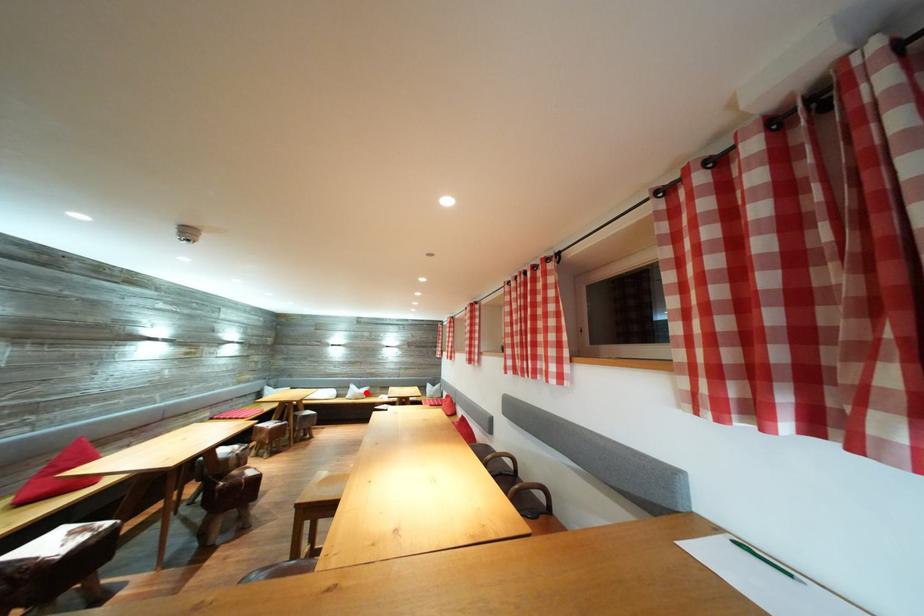
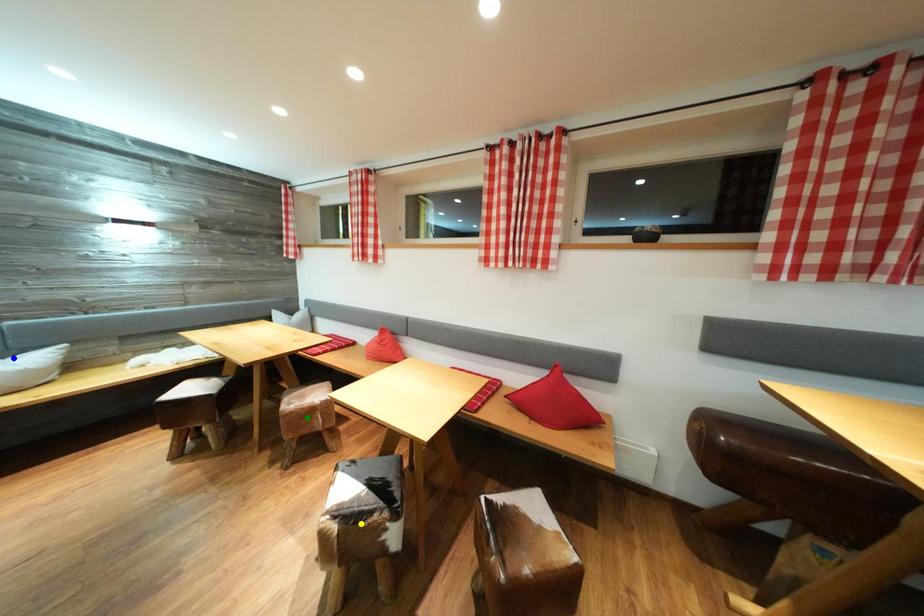
Question: I am providing you with two images of the same scene from different viewpoints. A red point is marked on the first image. You are given multiple points on the second image. Can you choose the point in image 2 that corresponds to the point in image 1?

Choices:
 (A) blue point
 (B) yellow point
 (C) green point

Answer: (A)